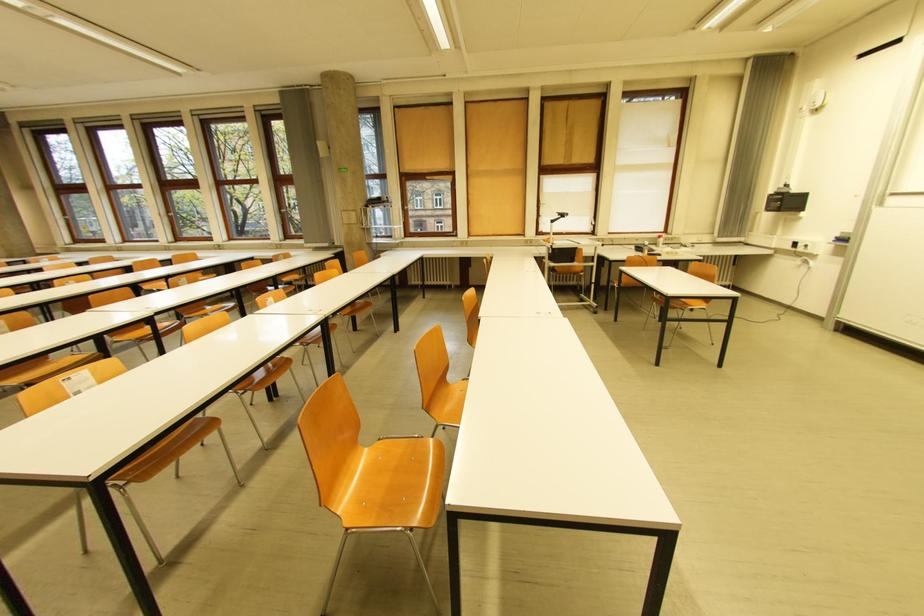
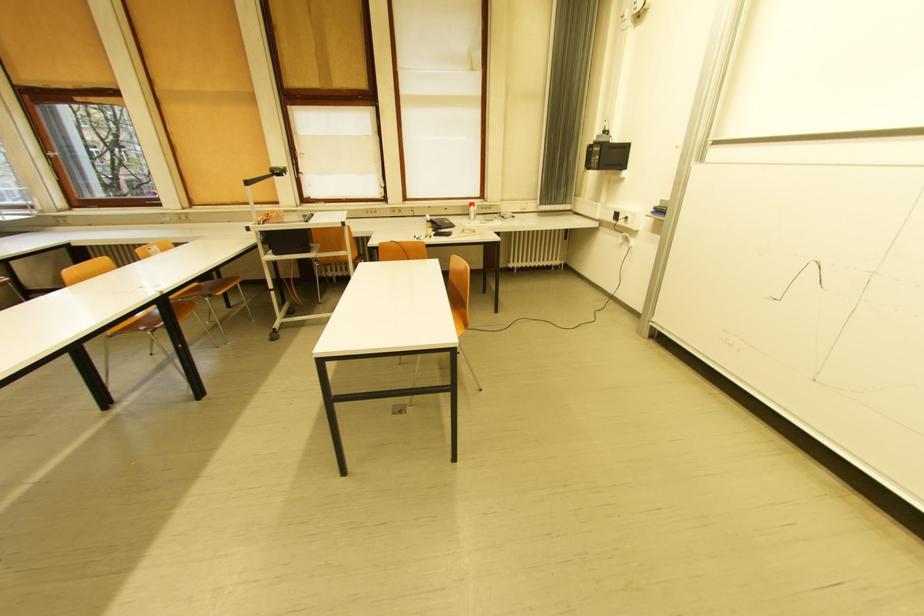
Locate, in the second image, the point that corresponds to (843,238) in the first image.

(662, 209)